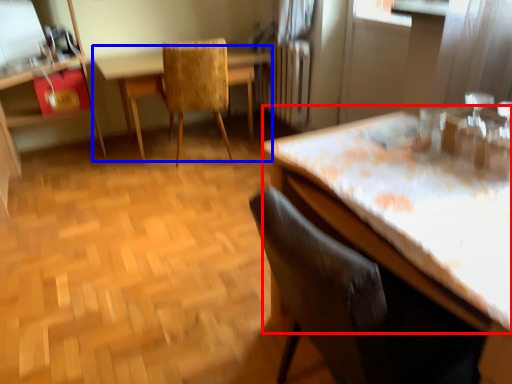
Question: Which object is closer to the camera taking this photo, counter top (highlighted by a red box) or table (highlighted by a blue box)?

Choices:
 (A) counter top
 (B) table

Answer: (A)